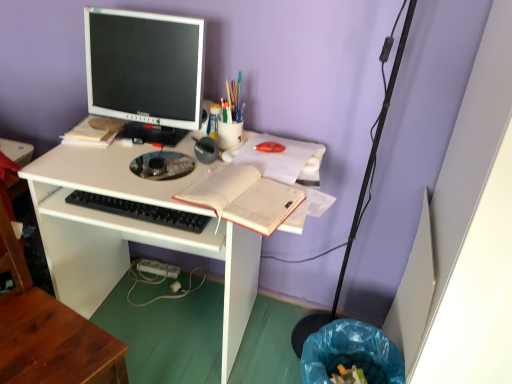
Where is `vacant space situated on the left part of white plastic power plugs and sockets at lower center`? The image size is (512, 384). vacant space situated on the left part of white plastic power plugs and sockets at lower center is located at coordinates (150, 288).